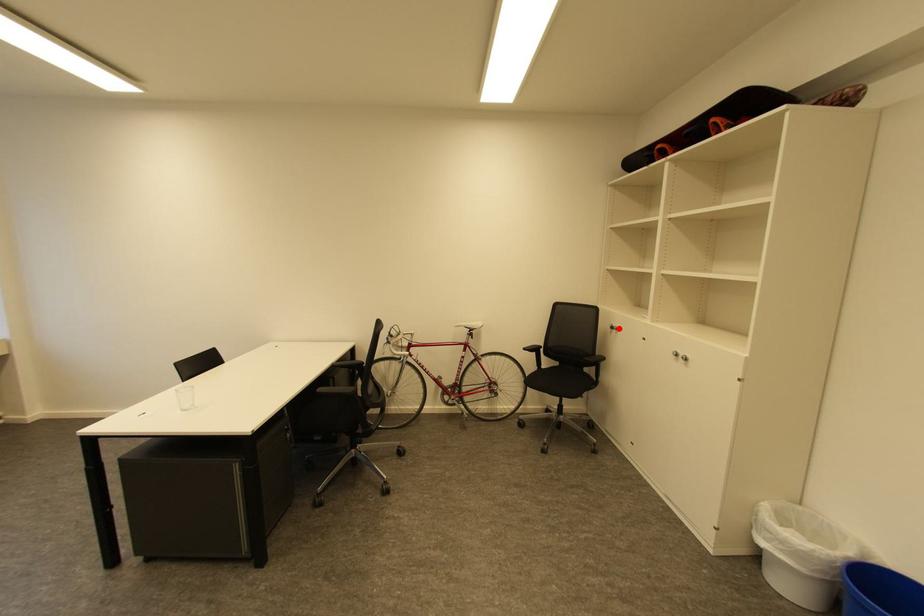
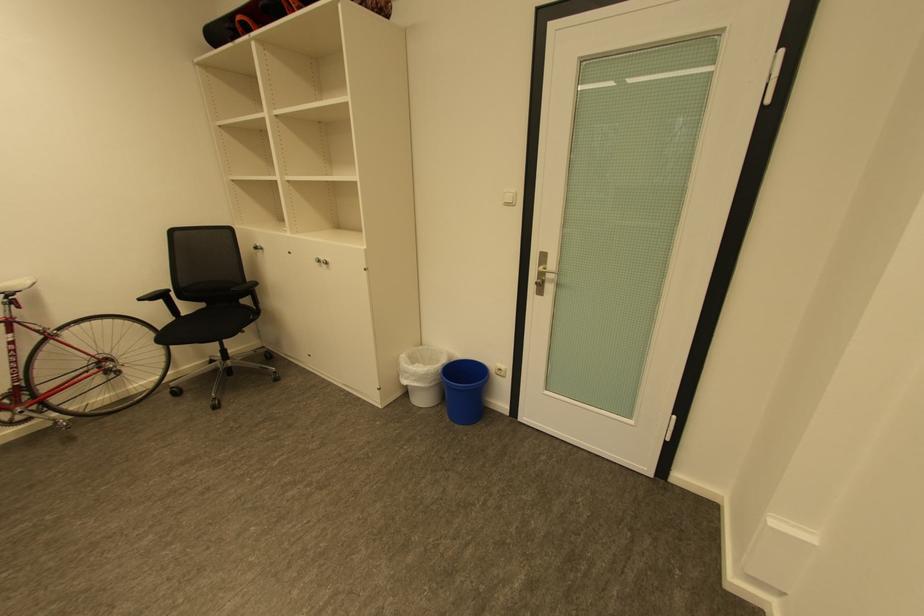
In the second image, find the point that corresponds to the highlighted location in the first image.

(262, 248)